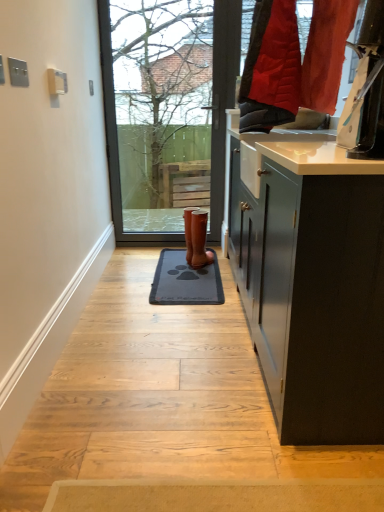
Describe the element at coordinates (185, 281) in the screenshot. I see `dark gray rubber doormat at center` at that location.

The image size is (384, 512). What do you see at coordinates (199, 240) in the screenshot? I see `brown leather boot at center` at bounding box center [199, 240].

The height and width of the screenshot is (512, 384). What are the coordinates of `dark gray rubber doormat at center` in the screenshot? It's located at (185, 281).

From a real-world perspective, which is physically above, bare branches at upper center or brown leather boot at center?

bare branches at upper center is physically above.

Which is behind, bare branches at upper center or brown leather boot at center?

Positioned behind is bare branches at upper center.

Does point (156, 37) come in front of point (210, 260)?

No, it is behind (210, 260).

Between dark gray rubber doormat at center and brown leather boot at center, which one has larger width?

With larger width is dark gray rubber doormat at center.

Is dark gray rubber doormat at center directly adjacent to brown leather boot at center?

No, dark gray rubber doormat at center is not beside brown leather boot at center.

Is dark gray rubber doormat at center at the right side of brown leather boot at center?

No, dark gray rubber doormat at center is not to the right of brown leather boot at center.

Where is `doormat directly beneath the brown leather boot at center (from a real-world perspective)`? This screenshot has width=384, height=512. doormat directly beneath the brown leather boot at center (from a real-world perspective) is located at coordinates (185, 281).

Between brown leather boot at center and dark gray rubber doormat at center, which one has larger width?

dark gray rubber doormat at center.

Between point (194, 266) and point (173, 261), which one is positioned behind?

The point (173, 261) is farther from the camera.

Based on the photo, from the image's perspective, which one is positioned higher, brown leather boot at center or dark gray rubber doormat at center?

brown leather boot at center appears higher in the image.

Is dark gray rubber doormat at center oriented away from bare branches at upper center?

No, dark gray rubber doormat at center's orientation is not away from bare branches at upper center.

Is bare branches at upper center completely or partially inside dark gray rubber doormat at center?

No, bare branches at upper center is not surrounded by dark gray rubber doormat at center.

From the picture: Considering the relative positions of dark gray rubber doormat at center and bare branches at upper center in the image provided, is dark gray rubber doormat at center to the left of bare branches at upper center from the viewer's perspective?

In fact, dark gray rubber doormat at center is to the right of bare branches at upper center.

Is brown leather boot at center wider or thinner than bare branches at upper center?

In the image, brown leather boot at center appears to be wider than bare branches at upper center.

Is brown leather boot at center not within bare branches at upper center?

Yes, brown leather boot at center is outside of bare branches at upper center.

In the scene shown: Which is more to the right, brown leather boot at center or bare branches at upper center?

brown leather boot at center is more to the right.

Considering the positions of objects bare branches at upper center and dark gray rubber doormat at center in the image provided, who is more to the left, bare branches at upper center or dark gray rubber doormat at center?

bare branches at upper center.

Looking at this image, from the image's perspective, which is below, bare branches at upper center or dark gray rubber doormat at center?

dark gray rubber doormat at center, from the image's perspective.

Could you tell me if bare branches at upper center is turned towards dark gray rubber doormat at center?

Yes, bare branches at upper center is facing dark gray rubber doormat at center.

Is bare branches at upper center completely or partially outside of dark gray rubber doormat at center?

Yes, bare branches at upper center is outside of dark gray rubber doormat at center.

Locate an element on the screen. tree behind the brown leather boot at center is located at coordinates (161, 96).

Find the location of a particular element. doormat on the left of brown leather boot at center is located at coordinates (185, 281).

Looking at the image, which one is located closer to bare branches at upper center, dark gray rubber doormat at center or brown leather boot at center?

The object closer to bare branches at upper center is brown leather boot at center.

From the image, which object appears to be nearer to brown leather boot at center, dark gray rubber doormat at center or bare branches at upper center?

Based on the image, dark gray rubber doormat at center appears to be nearer to brown leather boot at center.

In the scene shown: Estimate the real-world distances between objects in this image. Which object is closer to dark gray rubber doormat at center, brown leather boot at center or bare branches at upper center?

brown leather boot at center lies closer to dark gray rubber doormat at center than the other object.

Looking at the image, which one is located further to brown leather boot at center, bare branches at upper center or dark gray rubber doormat at center?

The object further to brown leather boot at center is bare branches at upper center.

From the image, which object appears to be farther from dark gray rubber doormat at center, bare branches at upper center or brown leather boot at center?

The object further to dark gray rubber doormat at center is bare branches at upper center.

From the image, which object appears to be farther from bare branches at upper center, brown leather boot at center or dark gray rubber doormat at center?

dark gray rubber doormat at center.

I want to click on footwear between bare branches at upper center and dark gray rubber doormat at center from top to bottom, so click(199, 240).